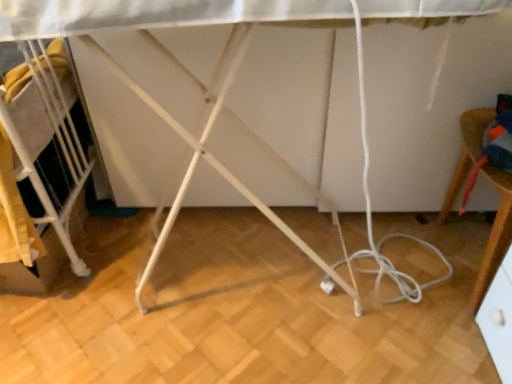
This screenshot has height=384, width=512. Find the location of `vacant position to the left of wooden chair at right`. vacant position to the left of wooden chair at right is located at coordinates (x=387, y=273).